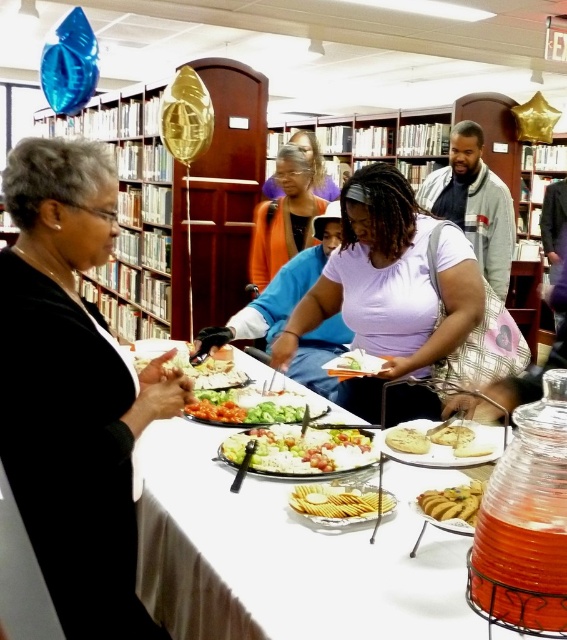
The width and height of the screenshot is (567, 640). What are the coordinates of `black matte sweater at left` in the screenshot? It's located at (73, 390).

Does black matte sweater at left have a greater width compared to orange fabric shirt at center?

No.

Does point (39, 339) come closer to viewer compared to point (284, 148)?

Yes, point (39, 339) is closer to viewer.

You are a GUI agent. You are given a task and a screenshot of the screen. Output one action in this format:
    pyautogui.click(x=<x>, y=<y>)
    Task: Click on the black matte sweater at left
    
    Given the screenshot: What is the action you would take?
    pyautogui.click(x=73, y=390)

Is point (464, 460) closer to viewer compared to point (447, 492)?

Yes, it is.

Is the position of golden brown bread at center less distant than that of golden brown cracker at lower center?

No, golden brown bread at center is behind golden brown cracker at lower center.

Is point (429, 422) positioned in front of point (467, 515)?

No, it is not.

Find the location of a particular element. golden brown bread at center is located at coordinates (446, 445).

Between vibrant green salad at center and white crumbly bread at center, which one is positioned higher?

white crumbly bread at center is above.

Measure the distance from vibrant green salad at center to white crumbly bread at center.

vibrant green salad at center is 29.34 inches away from white crumbly bread at center.

Who is more forward, (239, 404) or (466, 426)?

Positioned in front is point (466, 426).

You are a GUI agent. You are given a task and a screenshot of the screen. Output one action in this format:
    pyautogui.click(x=<x>, y=<y>)
    Task: Click on the vibrant green salad at center
    
    Given the screenshot: What is the action you would take?
    pyautogui.click(x=246, y=406)